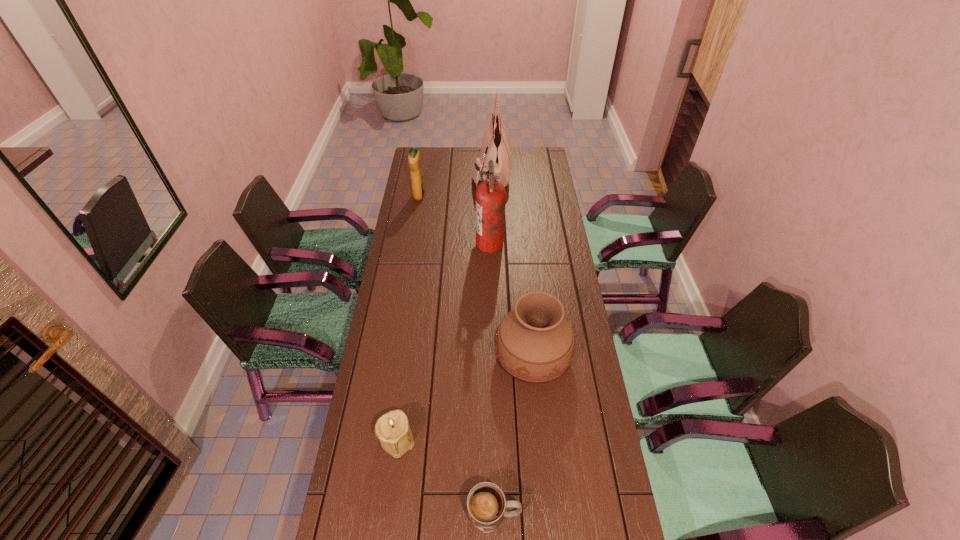
Where is `vacant point located 0.210m on the side of the handbag with the attached pouch`? This screenshot has height=540, width=960. vacant point located 0.210m on the side of the handbag with the attached pouch is located at coordinates (433, 172).

What are the coordinates of `vacant space located on the front of the fire extinguisher near the operation label` in the screenshot? It's located at (421, 244).

Where is `vacant region located on the front of the fire extinguisher near the operation label`? The image size is (960, 540). vacant region located on the front of the fire extinguisher near the operation label is located at coordinates (465, 244).

At what (x,y) coordinates should I click in order to perform the action: click on free space located on the front of the fire extinguisher near the operation label. Please return your answer as a coordinate pair (x, y). The height and width of the screenshot is (540, 960). Looking at the image, I should click on (451, 244).

Where is `free spot located on the label of the detergent`? Image resolution: width=960 pixels, height=540 pixels. free spot located on the label of the detergent is located at coordinates click(490, 195).

This screenshot has width=960, height=540. Identify the location of free location located 0.230m on the front of the urn. (543, 462).

I want to click on vacant position located 0.190m on the back of the candle_holder, so click(x=407, y=368).

I want to click on free location located 0.120m on the side of the shortest object with the handle, so [x=565, y=516].

In order to click on object that is at the far edge in this screenshot , I will do `click(495, 146)`.

Locate an element on the screen. This screenshot has width=960, height=540. detergent positioned at the left edge is located at coordinates (418, 190).